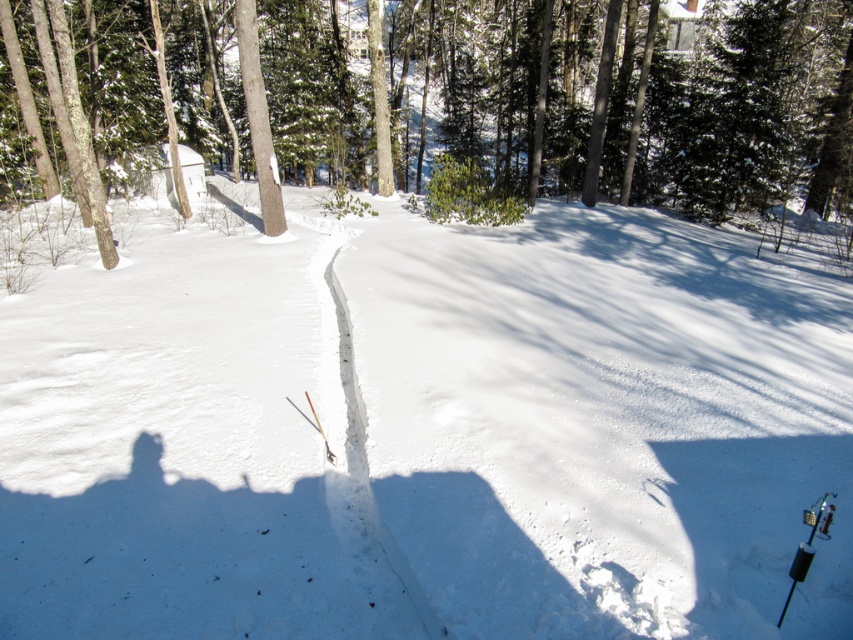
Question: Estimate the real-world distances between objects in this image. Which object is farther from the white snow trail at center?

Choices:
 (A) brown smooth tree at upper center
 (B) white powdery snow at center

Answer: (A)

Question: Which object appears closest to the camera in this image?

Choices:
 (A) white powdery snow at center
 (B) white snow trail at center

Answer: (A)

Question: Which of these objects is positioned closest to the white powdery snow at center?

Choices:
 (A) brown smooth tree at upper center
 (B) white snow trail at center

Answer: (B)

Question: Does white powdery snow at center come behind brown smooth tree at upper center?

Choices:
 (A) no
 (B) yes

Answer: (A)

Question: Can you confirm if white powdery snow at center is positioned above white snow trail at center?

Choices:
 (A) yes
 (B) no

Answer: (A)

Question: Does brown smooth tree at upper center have a smaller size compared to white snow trail at center?

Choices:
 (A) no
 (B) yes

Answer: (A)